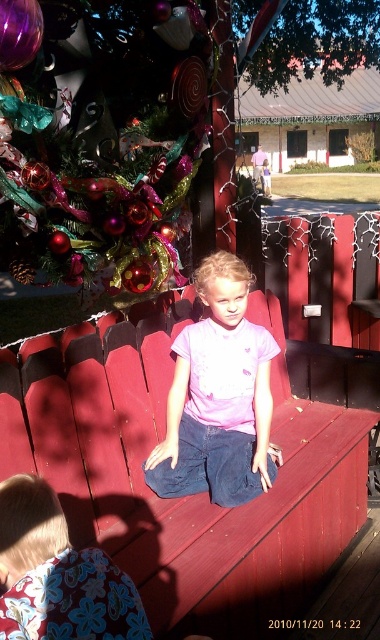
You are standing at the origin point of the image. The pink matte shirt at center is represented by point (218,396). Which direction should you move to reach the pink matte shirt at center?

To reach the pink matte shirt at center, you should move towards the point with coordinates (218,396).

You are a photographer setting up a shot of the festive outdoor scene. You need to ensure that the pink matte shirt at center and the floral fabric at lower left are both visible in the frame. Given their relative positions, which object should you adjust your camera angle to focus on first to ensure both are in view?

The pink matte shirt at center is taller than the floral fabric at lower left. To ensure both are visible, focus on the taller pink matte shirt at center first, then adjust the angle to include the shorter floral fabric at lower left in the frame.

You are standing at the entrance of the park and see the point at coordinates (186, 497). What object is located at that point?

The point at coordinates (186, 497) marks the matte wood park bench at center.